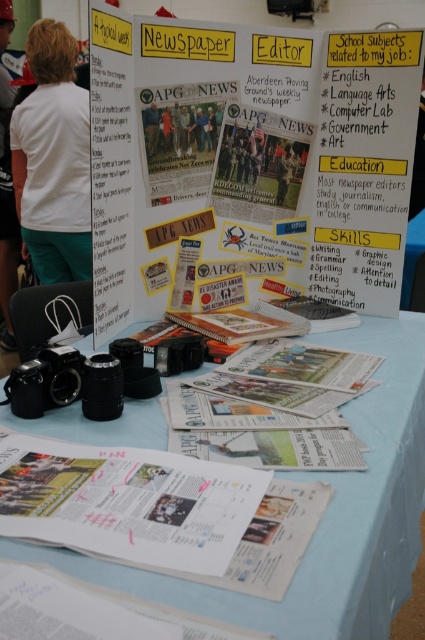
Question: Does white paper at center appear over matte black camera at center?

Choices:
 (A) yes
 (B) no

Answer: (B)

Question: Which point is closer to the camera?

Choices:
 (A) white glossy magazine at center
 (B) matte newspaper at center

Answer: (A)

Question: Which object is positioned farthest from the white t-shirt at upper left?

Choices:
 (A) matte newspaper at center
 (B) matte black camera at center
 (C) matte paper poster at center
 (D) white glossy magazine at center

Answer: (D)

Question: Does white paper at center appear under white fabric at upper left?

Choices:
 (A) yes
 (B) no

Answer: (A)

Question: Which of these objects is positioned farthest from the white t-shirt at upper left?

Choices:
 (A) white fabric at upper left
 (B) white paper at center

Answer: (B)

Question: Is white paper at center below white t-shirt at upper left?

Choices:
 (A) yes
 (B) no

Answer: (A)